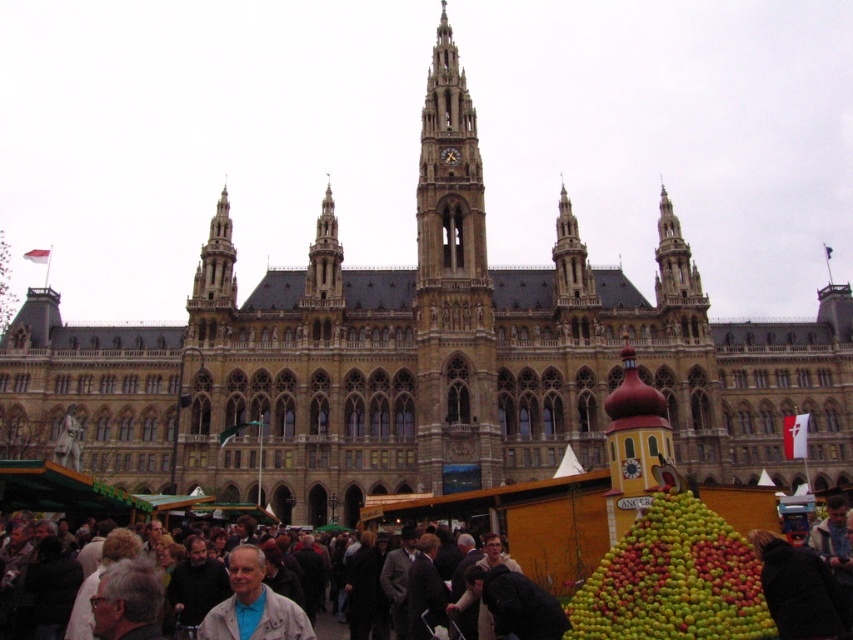
Question: Which of these objects is positioned closest to the brown stone tower at center?

Choices:
 (A) brown stone tower at upper center
 (B) light gray jacket at center
 (C) dark brown coat at lower right
 (D) green matte apples at lower right

Answer: (A)

Question: Does green matte apples at lower right come behind dark brown coat at lower right?

Choices:
 (A) yes
 (B) no

Answer: (A)

Question: Which point appears closest to the camera in this image?

Choices:
 (A) (809, 563)
 (B) (337, 272)

Answer: (A)

Question: Which of the following is the farthest from the observer?

Choices:
 (A) light gray jacket at center
 (B) green matte apples at lower right
 (C) golden stone tower at center

Answer: (C)

Question: Is brown stone tower at center below dark brown leather jacket at lower center?

Choices:
 (A) yes
 (B) no

Answer: (B)

Question: Is dark brown coat at lower right further to the viewer compared to brown stone tower at upper center?

Choices:
 (A) no
 (B) yes

Answer: (A)